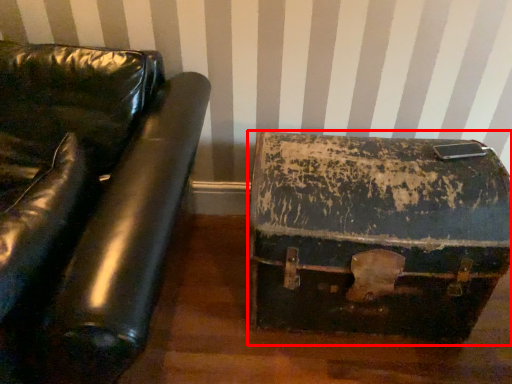
Question: From the image's perspective, where is suitcase (annotated by the red box) located in relation to furniture in the image?

Choices:
 (A) above
 (B) below

Answer: (B)